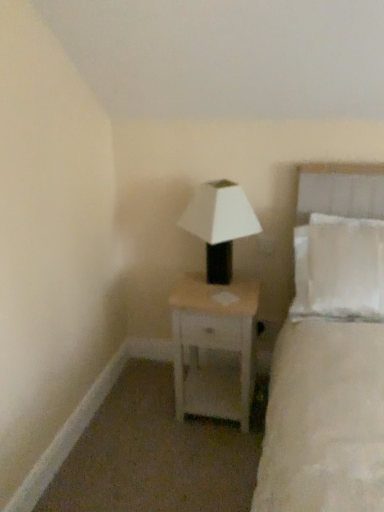
Question: Based on their sizes in the image, would you say white matte nightstand at center is bigger or smaller than white matte lamp at center?

Choices:
 (A) small
 (B) big

Answer: (B)

Question: Is white matte nightstand at center wider or thinner than white matte lamp at center?

Choices:
 (A) wide
 (B) thin

Answer: (A)

Question: Which of these objects is positioned closest to the white fabric bed at right?

Choices:
 (A) white matte nightstand at center
 (B) white matte lamp at center

Answer: (A)

Question: Estimate the real-world distances between objects in this image. Which object is closer to the white matte nightstand at center?

Choices:
 (A) white matte lamp at center
 (B) white fabric bed at right

Answer: (A)